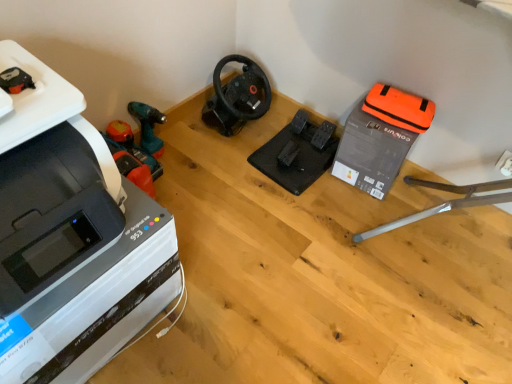
The height and width of the screenshot is (384, 512). Identify the location of white plastic printer at left. (71, 237).

From the picture: Measure the distance between orange fabric bag at upper right, which appears as the second equipment when viewed from the left, and camera.

4.60 feet.

Locate an element on the screen. orange plastic vacuum at left, which ranks as the 2th vacuum in right-to-left order is located at coordinates (137, 147).

Considering the relative positions of white plastic printer at left and black matte steering wheel at center, the second vacuum positioned from the left, in the image provided, is white plastic printer at left to the left or to the right of black matte steering wheel at center, the second vacuum positioned from the left,?

Clearly, white plastic printer at left is on the left of black matte steering wheel at center, the second vacuum positioned from the left, in the image.

Considering the sizes of white plastic printer at left and black matte steering wheel at center, the second vacuum positioned from the left, in the image, is white plastic printer at left taller or shorter than black matte steering wheel at center, the second vacuum positioned from the left,?

Considering their sizes, white plastic printer at left has more height than black matte steering wheel at center, the second vacuum positioned from the left.

Which of these two, white plastic printer at left or black matte steering wheel at center, the second vacuum positioned from the left, is bigger?

With larger size is white plastic printer at left.

Is white plastic printer at left not close to black matte steering wheel at center, positioned as the first vacuum in right-to-left order?

No, there isn't a large distance between white plastic printer at left and black matte steering wheel at center, positioned as the first vacuum in right-to-left order.

Relative to white plastic printer at left, is black rubber pedals at center, which is the 1th equipment in left-to-right order, in front or behind?

Visually, black rubber pedals at center, which is the 1th equipment in left-to-right order, is located behind white plastic printer at left.

From the image's perspective, is black rubber pedals at center, which is the 1th equipment in left-to-right order, on white plastic printer at left?

Correct, black rubber pedals at center, which is the 1th equipment in left-to-right order, appears higher than white plastic printer at left in the image.

Is white plastic printer at left aimed at orange fabric bag at upper right, which appears as the second equipment when viewed from the left?

No, white plastic printer at left does not turn towards orange fabric bag at upper right, which appears as the second equipment when viewed from the left.

From a real-world perspective, is white plastic printer at left located beneath orange fabric bag at upper right, which appears as the second equipment when viewed from the left?

No, from a real-world perspective, white plastic printer at left is not below orange fabric bag at upper right, which appears as the second equipment when viewed from the left.

Based on the photo, considering the positions of objects white plastic printer at left and orange fabric bag at upper right, which appears as the second equipment when viewed from the left, in the image provided, who is more to the left, white plastic printer at left or orange fabric bag at upper right, which appears as the second equipment when viewed from the left,?

white plastic printer at left is more to the left.

Does orange plastic vacuum at left, which ranks as the 2th vacuum in right-to-left order, have a smaller size compared to black matte steering wheel at center, positioned as the first vacuum in right-to-left order?

Indeed, orange plastic vacuum at left, which ranks as the 2th vacuum in right-to-left order, has a smaller size compared to black matte steering wheel at center, positioned as the first vacuum in right-to-left order.

From the image's perspective, between orange plastic vacuum at left, which ranks as the 2th vacuum in right-to-left order, and black matte steering wheel at center, positioned as the first vacuum in right-to-left order, which one is located above?

black matte steering wheel at center, positioned as the first vacuum in right-to-left order, from the image's perspective.

Visually, is orange plastic vacuum at left, the first vacuum from the left, positioned to the left or to the right of black matte steering wheel at center, the second vacuum positioned from the left?

orange plastic vacuum at left, the first vacuum from the left, is positioned on black matte steering wheel at center, the second vacuum positioned from the left,'s left side.

Can you tell me how much orange plastic vacuum at left, which ranks as the 2th vacuum in right-to-left order, and black matte steering wheel at center, the second vacuum positioned from the left, differ in facing direction?

orange plastic vacuum at left, which ranks as the 2th vacuum in right-to-left order, and black matte steering wheel at center, the second vacuum positioned from the left, are facing 89.9 degrees away from each other.

Which is farther from the camera, [154,141] or [254,156]?

The point [254,156] is farther from the camera.

From the picture: Is orange plastic vacuum at left, the first vacuum from the left, wider than black rubber pedals at center, which is the second equipment in right-to-left order?

Incorrect, the width of orange plastic vacuum at left, the first vacuum from the left, does not surpass that of black rubber pedals at center, which is the second equipment in right-to-left order.

Based on the photo, between orange plastic vacuum at left, which ranks as the 2th vacuum in right-to-left order, and black rubber pedals at center, which is the second equipment in right-to-left order, which one appears on the left side from the viewer's perspective?

From the viewer's perspective, orange plastic vacuum at left, which ranks as the 2th vacuum in right-to-left order, appears more on the left side.

From the image's perspective, which object appears higher, orange plastic vacuum at left, which ranks as the 2th vacuum in right-to-left order, or black rubber pedals at center, which is the second equipment in right-to-left order?

black rubber pedals at center, which is the second equipment in right-to-left order, from the image's perspective.

Between white plastic printer at left and black rubber pedals at center, which is the second equipment in right-to-left order, which one appears on the left side from the viewer's perspective?

white plastic printer at left is more to the left.

Which of these two, white plastic printer at left or black rubber pedals at center, which is the 1th equipment in left-to-right order, stands taller?

white plastic printer at left.

From the image's perspective, is white plastic printer at left under black rubber pedals at center, which is the second equipment in right-to-left order?

Indeed, from the image's perspective, white plastic printer at left is shown beneath black rubber pedals at center, which is the second equipment in right-to-left order.

Considering the relative positions of black rubber pedals at center, which is the second equipment in right-to-left order, and orange fabric bag at upper right, which appears as the second equipment when viewed from the left, in the image provided, is black rubber pedals at center, which is the second equipment in right-to-left order, to the right of orange fabric bag at upper right, which appears as the second equipment when viewed from the left, from the viewer's perspective?

In fact, black rubber pedals at center, which is the second equipment in right-to-left order, is to the left of orange fabric bag at upper right, which appears as the second equipment when viewed from the left.

Considering the points (287, 150) and (338, 162), which point is behind, point (287, 150) or point (338, 162)?

The point (287, 150) is farther.

Is black rubber pedals at center, which is the second equipment in right-to-left order, positioned in front of orange fabric bag at upper right, which appears as the second equipment when viewed from the left?

No, it is not.

How much distance is there between black rubber pedals at center, which is the second equipment in right-to-left order, and orange fabric bag at upper right, which appears as the second equipment when viewed from the left?

black rubber pedals at center, which is the second equipment in right-to-left order, and orange fabric bag at upper right, which appears as the second equipment when viewed from the left, are 8.99 inches apart from each other.

At what (x,y) coordinates should I click in order to perform the action: click on the 2nd vacuum above when counting from the white plastic printer at left (from the image's perspective). Please return your answer as a coordinate pair (x, y). Image resolution: width=512 pixels, height=384 pixels. Looking at the image, I should click on tap(237, 97).

From a real-world perspective, starting from the white plastic printer at left, which equipment is the 2nd one below it? Please provide its 2D coordinates.

[(297, 153)]

Estimate the real-world distances between objects in this image. Which object is closer to orange plastic vacuum at left, the first vacuum from the left, orange fabric bag at upper right, which is the first equipment in right-to-left order, or white plastic printer at left?

white plastic printer at left.

Looking at the image, which one is located closer to white plastic printer at left, orange fabric bag at upper right, which is the first equipment in right-to-left order, or black rubber pedals at center, which is the 1th equipment in left-to-right order?

black rubber pedals at center, which is the 1th equipment in left-to-right order, is positioned closer to the anchor white plastic printer at left.

Which object lies nearer to the anchor point orange plastic vacuum at left, the first vacuum from the left, black matte steering wheel at center, positioned as the first vacuum in right-to-left order, or black rubber pedals at center, which is the second equipment in right-to-left order?

The object closer to orange plastic vacuum at left, the first vacuum from the left, is black matte steering wheel at center, positioned as the first vacuum in right-to-left order.

Which object lies further to the anchor point orange plastic vacuum at left, which ranks as the 2th vacuum in right-to-left order, white plastic printer at left or black rubber pedals at center, which is the second equipment in right-to-left order?

black rubber pedals at center, which is the second equipment in right-to-left order, is positioned further to the anchor orange plastic vacuum at left, which ranks as the 2th vacuum in right-to-left order.

Estimate the real-world distances between objects in this image. Which object is further from black matte steering wheel at center, positioned as the first vacuum in right-to-left order, orange plastic vacuum at left, which ranks as the 2th vacuum in right-to-left order, or black rubber pedals at center, which is the 1th equipment in left-to-right order?

orange plastic vacuum at left, which ranks as the 2th vacuum in right-to-left order, is further to black matte steering wheel at center, positioned as the first vacuum in right-to-left order.

From the image, which object appears to be farther from black rubber pedals at center, which is the 1th equipment in left-to-right order, white plastic printer at left or orange plastic vacuum at left, the first vacuum from the left?

white plastic printer at left is further to black rubber pedals at center, which is the 1th equipment in left-to-right order.

Based on their spatial positions, is orange plastic vacuum at left, which ranks as the 2th vacuum in right-to-left order, or orange fabric bag at upper right, which is the first equipment in right-to-left order, closer to white plastic printer at left?

orange plastic vacuum at left, which ranks as the 2th vacuum in right-to-left order, lies closer to white plastic printer at left than the other object.

When comparing their distances from orange plastic vacuum at left, which ranks as the 2th vacuum in right-to-left order, does orange fabric bag at upper right, which is the first equipment in right-to-left order, or black rubber pedals at center, which is the 1th equipment in left-to-right order, seem closer?

black rubber pedals at center, which is the 1th equipment in left-to-right order, lies closer to orange plastic vacuum at left, which ranks as the 2th vacuum in right-to-left order, than the other object.

Locate an element on the screen. The image size is (512, 384). equipment situated between orange plastic vacuum at left, which ranks as the 2th vacuum in right-to-left order, and orange fabric bag at upper right, which appears as the second equipment when viewed from the left, from left to right is located at coordinates (297, 153).

Locate an element on the screen. Image resolution: width=512 pixels, height=384 pixels. vacuum between white plastic printer at left and black matte steering wheel at center, positioned as the first vacuum in right-to-left order, from front to back is located at coordinates (137, 147).

At what (x,y) coordinates should I click in order to perform the action: click on vacuum between orange plastic vacuum at left, which ranks as the 2th vacuum in right-to-left order, and orange fabric bag at upper right, which appears as the second equipment when viewed from the left. Please return your answer as a coordinate pair (x, y). Looking at the image, I should click on (237, 97).

Locate an element on the screen. Image resolution: width=512 pixels, height=384 pixels. vacuum situated between orange plastic vacuum at left, which ranks as the 2th vacuum in right-to-left order, and black rubber pedals at center, which is the 1th equipment in left-to-right order, from left to right is located at coordinates (237, 97).